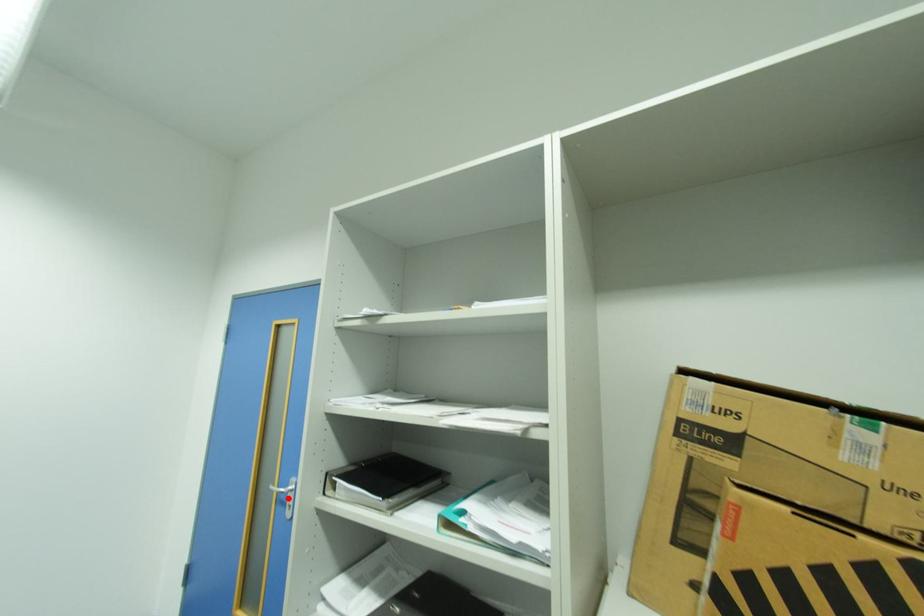
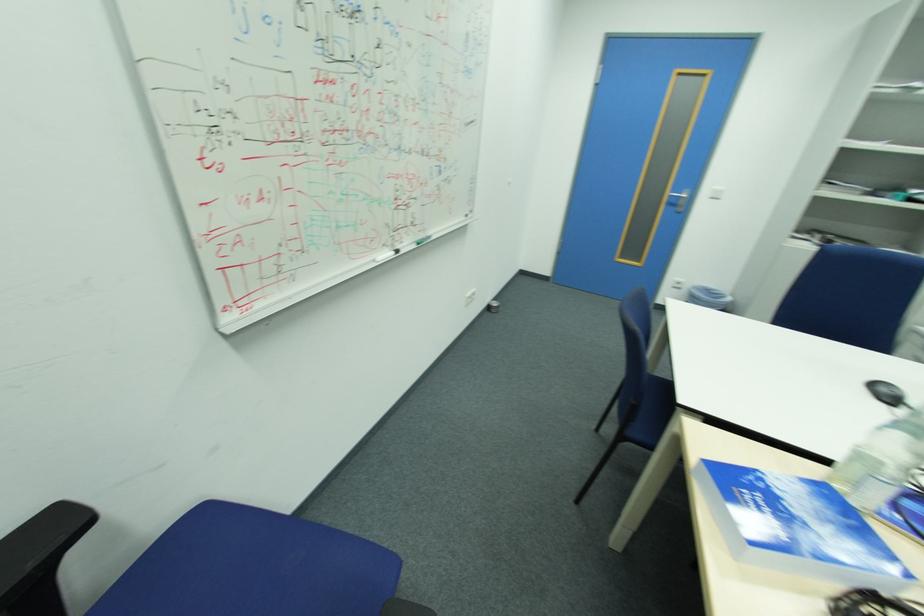
Question: A red point is marked in image1. In image2, is the corresponding 3D point closer to the camera or farther? Reply with the corresponding letter.

Choices:
 (A) The corresponding 3D point is closer.
 (B) The corresponding 3D point is farther.

Answer: (A)